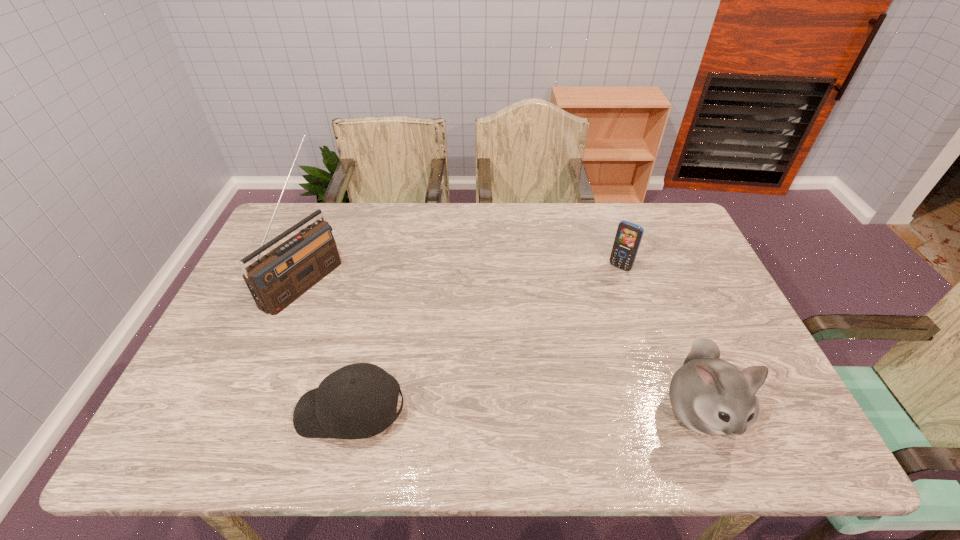
This screenshot has height=540, width=960. Find the location of `free spot between the cellular telephone and the hamster`. free spot between the cellular telephone and the hamster is located at coordinates (660, 339).

Identify the location of vacant space that is in between the cellular telephone and the baseball cap. The height and width of the screenshot is (540, 960). (485, 340).

Where is `free space between the third object from right to left and the third tallest object`? This screenshot has width=960, height=540. free space between the third object from right to left and the third tallest object is located at coordinates (485, 340).

Locate an element on the screen. This screenshot has height=540, width=960. free space between the leftmost object and the hamster is located at coordinates (501, 345).

I want to click on free point between the second object from left to right and the hamster, so click(x=524, y=411).

Locate an element on the screen. This screenshot has height=540, width=960. blank region between the hamster and the third object from right to left is located at coordinates (524, 411).

Where is `blank region between the second shortest object and the baseball cap`? blank region between the second shortest object and the baseball cap is located at coordinates click(485, 340).

Identify which object is located as the second nearest to the second shortest object. Please provide its 2D coordinates. Your answer should be formatted as a tuple, i.e. [(x, y)], where the tuple contains the x and y coordinates of a point satisfying the conditions above.

[(357, 401)]

Identify which object is the third nearest to the hamster. Please provide its 2D coordinates. Your answer should be formatted as a tuple, i.e. [(x, y)], where the tuple contains the x and y coordinates of a point satisfying the conditions above.

[(281, 276)]

Locate an element on the screen. The height and width of the screenshot is (540, 960). free space that satisfies the following two spatial constraints: 1. on the back side of the radio receiver; 2. on the left side of the third tallest object is located at coordinates [309, 267].